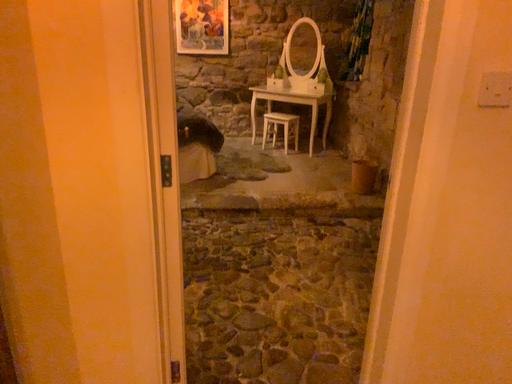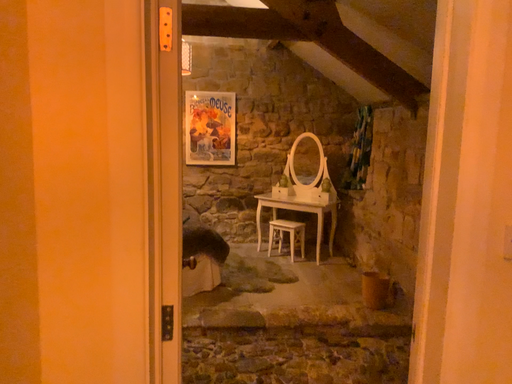
Question: How did the camera likely rotate when shooting the video?

Choices:
 (A) rotated upward
 (B) rotated downward

Answer: (A)